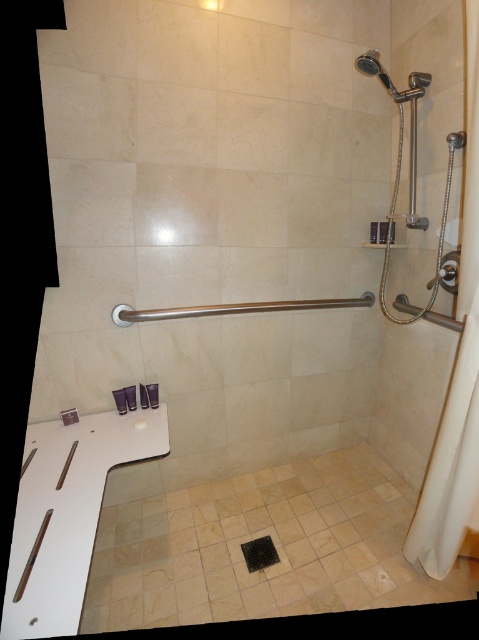
Is point (474, 432) less distant than point (283, 308)?

That is True.

Does white fabric shower curtain at right lie behind satin nickel towel bar at center?

That is False.

Where is `white fabric shower curtain at right`? Image resolution: width=479 pixels, height=640 pixels. white fabric shower curtain at right is located at coordinates (456, 376).

You are a GUI agent. You are given a task and a screenshot of the screen. Output one action in this format:
    pyautogui.click(x=<x>, y=<y>)
    Task: Click on the white fabric shower curtain at right
    This screenshot has width=479, height=640.
    Given the screenshot: What is the action you would take?
    point(456,376)

Can you confirm if satin nickel towel bar at center is wider than matte silver showerhead at upper right?

Yes.

Does satin nickel towel bar at center have a lesser height compared to matte silver showerhead at upper right?

Yes, satin nickel towel bar at center is shorter than matte silver showerhead at upper right.

Which is behind, point (250, 310) or point (377, 64)?

The point (250, 310) is behind.

I want to click on satin nickel towel bar at center, so click(x=232, y=308).

In the scene shown: How distant is white fabric shower curtain at right from matte silver showerhead at upper right?

They are 27.70 inches apart.

Does white fabric shower curtain at right appear on the left side of matte silver showerhead at upper right?

Incorrect, white fabric shower curtain at right is not on the left side of matte silver showerhead at upper right.

Is point (469, 476) closer to camera compared to point (371, 58)?

Yes, point (469, 476) is closer to viewer.

The height and width of the screenshot is (640, 479). In order to click on white fabric shower curtain at right in this screenshot , I will do `click(456, 376)`.